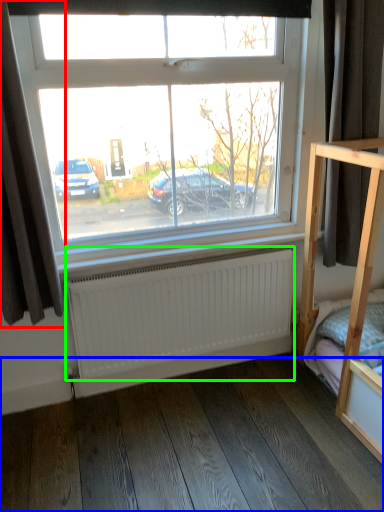
Question: Which object is the farthest from curtain (highlighted by a red box)? Choose among these: hardwood (highlighted by a blue box) or radiator (highlighted by a green box).

Choices:
 (A) hardwood
 (B) radiator

Answer: (A)